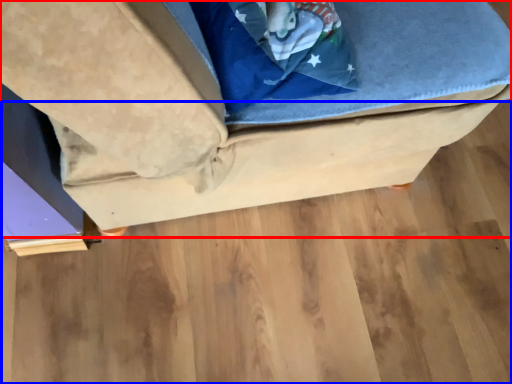
Question: Which point is further to the camera, furniture (highlighted by a red box) or wood (highlighted by a blue box)?

Choices:
 (A) furniture
 (B) wood

Answer: (B)